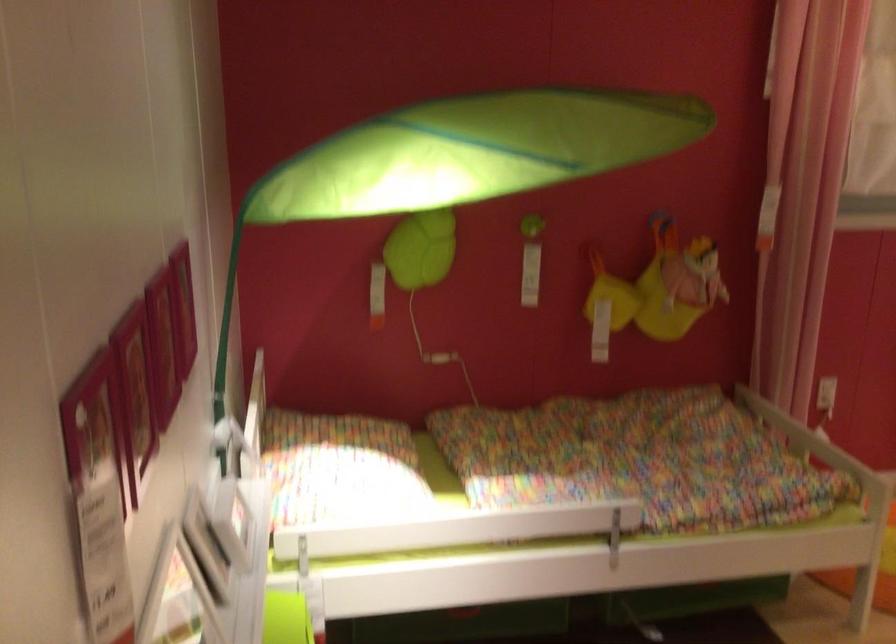
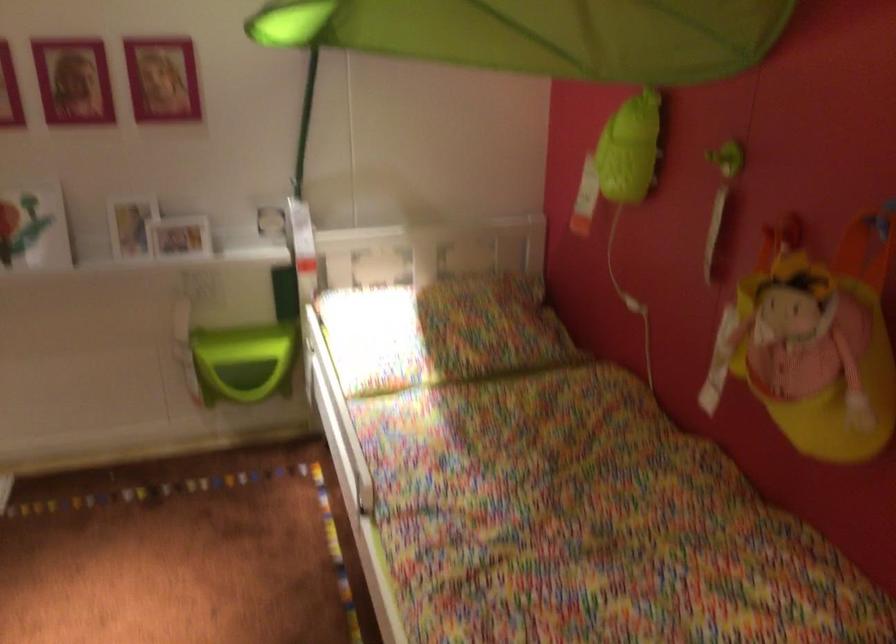
Find the pixel in the second image that matches (x=728, y=265) in the first image.

(814, 342)